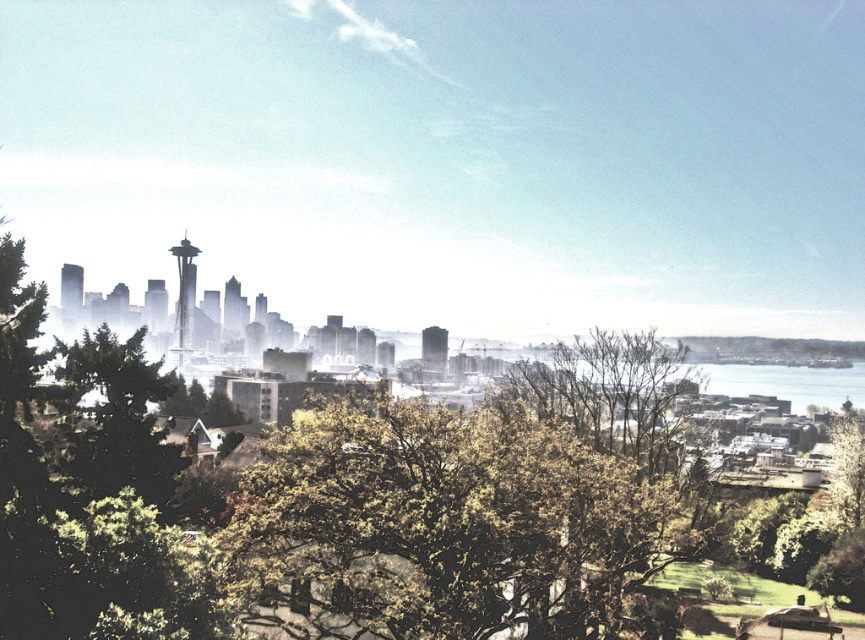
Between green leafy tree at center and green textured tree at left, which one appears on the left side from the viewer's perspective?

green textured tree at left

Is point (639, 496) closer to viewer compared to point (74, 468)?

Yes.

Identify the location of green leafy tree at center. The width and height of the screenshot is (865, 640). (445, 529).